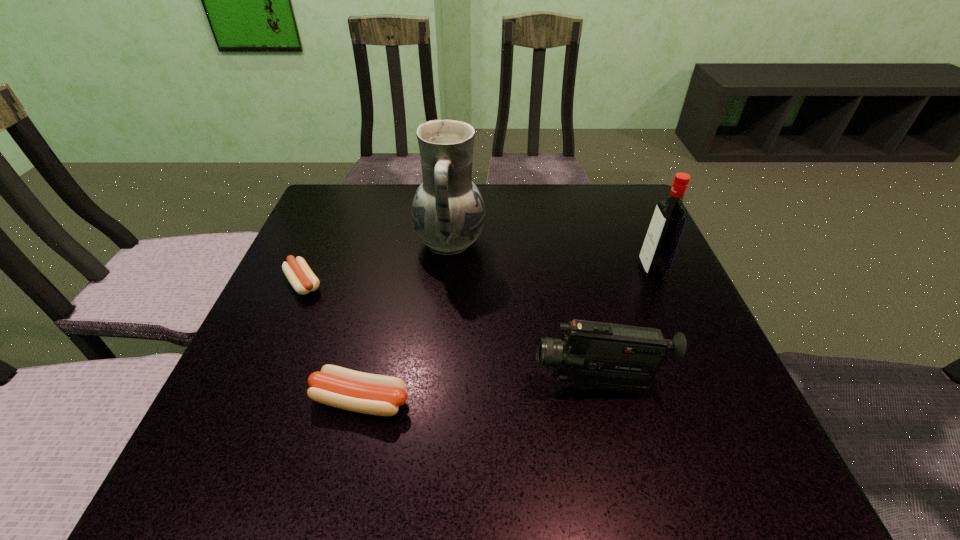
This screenshot has height=540, width=960. I want to click on free space located on the front and back of the vodka, so click(489, 270).

The height and width of the screenshot is (540, 960). In order to click on vacant space located on the front and back of the vodka in this screenshot , I will do `click(569, 270)`.

This screenshot has height=540, width=960. I want to click on free space located 0.340m on the front and back of the vodka, so click(x=489, y=270).

Locate an element on the screen. vacant region located on the front-facing side of the third tallest object is located at coordinates (459, 384).

Where is `free region located on the front-facing side of the third tallest object`? The height and width of the screenshot is (540, 960). free region located on the front-facing side of the third tallest object is located at coordinates (396, 384).

The width and height of the screenshot is (960, 540). I want to click on free point located 0.050m on the front-facing side of the third tallest object, so click(x=505, y=384).

Find the location of `vacant space located on the back of the second shortest object`. vacant space located on the back of the second shortest object is located at coordinates coord(373,343).

Identify the location of blank area located on the front of the farther sausage. (284, 330).

Find the location of a particular element. The height and width of the screenshot is (540, 960). object that is at the far edge is located at coordinates (448, 213).

The image size is (960, 540). Find the location of `vodka at the right edge`. vodka at the right edge is located at coordinates (663, 236).